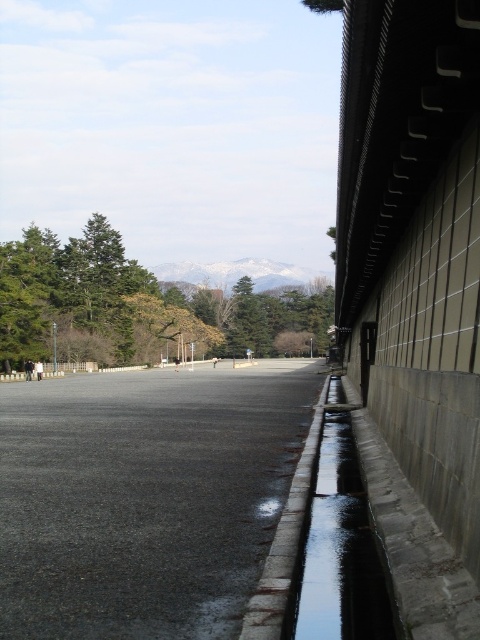
You are a photographer planning to capture a wide shot of the scene. Given that the black asphalt pavement at center and the green leafy tree at upper left are both in your frame, which object will occupy a larger portion of the photo?

The green leafy tree at upper left occupies more space in the photo than the black asphalt pavement at center according to the description.

You are a bird flying over the scene. You see the black asphalt pavement at center and the green leafy tree at upper left. Which object is closer to the ground?

The black asphalt pavement at center is closer to the ground than the green leafy tree at upper left because it is located below it.

From the picture: You are a painter standing on the gray concrete curb at lower right, looking towards the green leafy tree at upper left. Which object appears wider from your perspective?

The green leafy tree at upper left appears wider than the gray concrete curb at lower right because its width is larger than the curb.